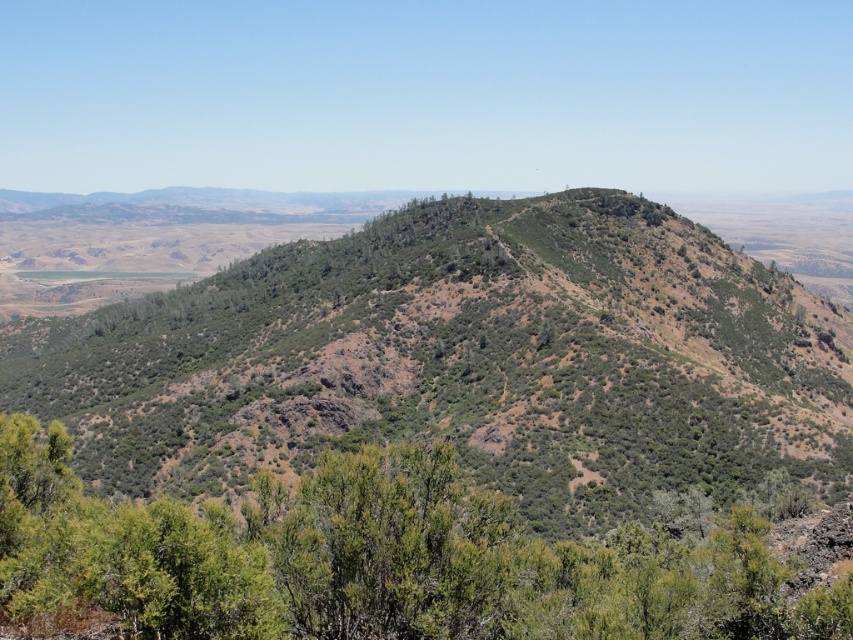
Is point (144, 452) less distant than point (578, 593)?

No.

Is green shrubbery at center wider than green leafy shrub at center?

Correct, the width of green shrubbery at center exceeds that of green leafy shrub at center.

Which is in front, point (326, 248) or point (535, 625)?

Positioned in front is point (535, 625).

Where is `green shrubbery at center`? This screenshot has width=853, height=640. green shrubbery at center is located at coordinates (463, 360).